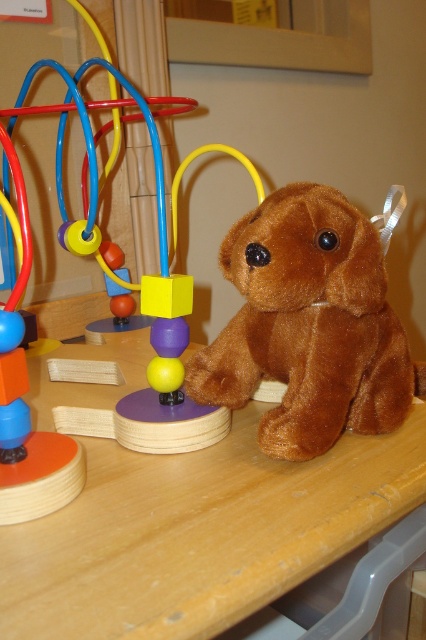
Question: Considering the real-world distances, which object is closest to the brown plush bear at right?

Choices:
 (A) brown plush toy at center
 (B) wooden table at center

Answer: (A)

Question: Is wooden table at center further to camera compared to brown plush bear at right?

Choices:
 (A) no
 (B) yes

Answer: (A)

Question: Does wooden table at center appear on the left side of brown plush bear at right?

Choices:
 (A) no
 (B) yes

Answer: (A)

Question: Which point appears closest to the camera in this image?

Choices:
 (A) (23, 276)
 (B) (98, 609)

Answer: (B)

Question: Which point appears farthest from the camera in this image?

Choices:
 (A) (396, 410)
 (B) (184, 444)
 (C) (163, 548)

Answer: (A)

Question: Does wooden table at center have a lesser width compared to brown plush bear at right?

Choices:
 (A) yes
 (B) no

Answer: (B)